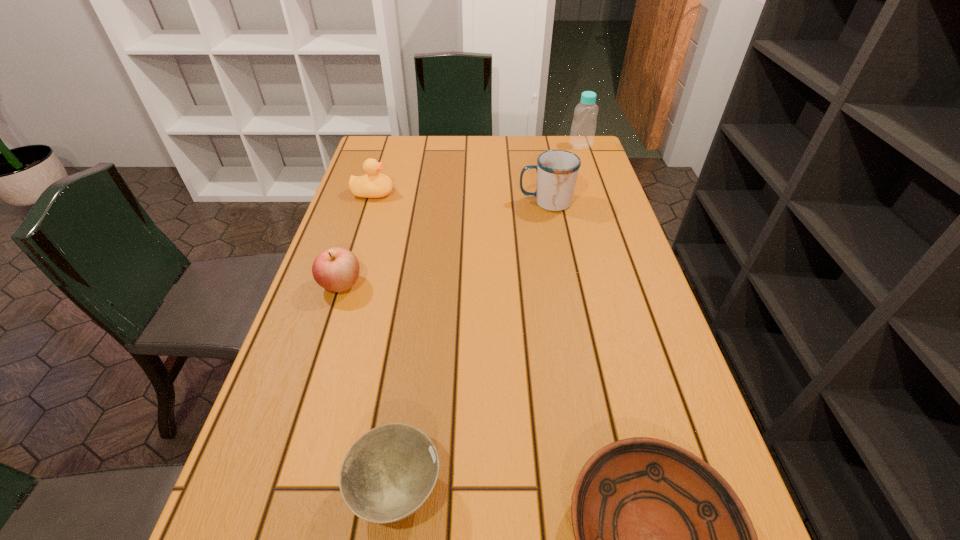
Where is `the tallest object`? Image resolution: width=960 pixels, height=540 pixels. the tallest object is located at coordinates (583, 127).

Where is `the farthest object`? Image resolution: width=960 pixels, height=540 pixels. the farthest object is located at coordinates (583, 127).

Identify the location of the second tallest object. The height and width of the screenshot is (540, 960). (557, 170).

Find the location of `duck`. duck is located at coordinates pyautogui.click(x=374, y=184).

This screenshot has height=540, width=960. I want to click on apple, so click(x=336, y=269).

Find the location of a particular element. free spot located 0.240m on the front of the bottle is located at coordinates (595, 190).

The height and width of the screenshot is (540, 960). What are the coordinates of `vacant space located on the handle side of the second tallest object` in the screenshot? It's located at (396, 202).

Locate an element on the screen. This screenshot has height=540, width=960. vacant space located 0.190m on the handle side of the second tallest object is located at coordinates (453, 202).

You are a GUI agent. You are given a task and a screenshot of the screen. Output one action in this format:
    pyautogui.click(x=<x>, y=<y>)
    Task: Click on the vacant point located 0.100m on the handle side of the second tallest object
    The image size is (960, 540).
    Given the screenshot: What is the action you would take?
    pyautogui.click(x=484, y=202)

You are a GUI agent. You are given a task and a screenshot of the screen. Output one action in this format:
    pyautogui.click(x=<x>, y=<y>)
    Task: Click on the vacant region located on the face of the duck
    Image resolution: width=960 pixels, height=540 pixels.
    Given the screenshot: What is the action you would take?
    pyautogui.click(x=484, y=193)